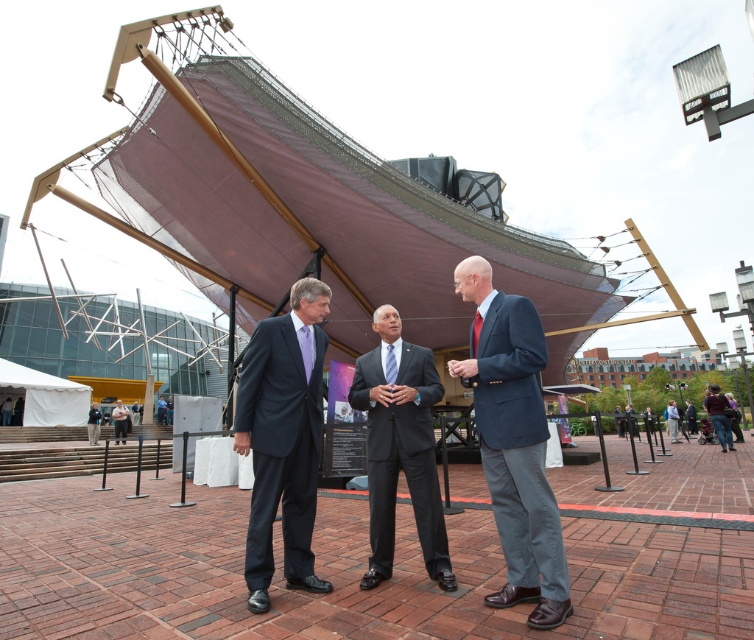
Does matte black suit at center have a lesser height compared to dark blue suit at center?

No.

Which of these two, matte black suit at center or dark blue suit at center, stands taller?

matte black suit at center is taller.

Is point (247, 403) positioned in front of point (400, 330)?

Yes, point (247, 403) is in front of point (400, 330).

You are a GUI agent. You are given a task and a screenshot of the screen. Output one action in this format:
    pyautogui.click(x=<x>, y=<y>)
    Task: Click on the matte black suit at center
    The image size is (754, 640).
    Given the screenshot: What is the action you would take?
    pyautogui.click(x=284, y=438)

Is matte navy blazer at center in front of matte black suit at center?

Yes.

Can you confirm if matte navy blazer at center is positioned above matte black suit at center?

Yes, matte navy blazer at center is above matte black suit at center.

What do you see at coordinates (513, 442) in the screenshot? I see `matte navy blazer at center` at bounding box center [513, 442].

Locate an element on the screen. This screenshot has width=754, height=640. matte navy blazer at center is located at coordinates (513, 442).

Between point (538, 394) and point (431, 566), which one is positioned in front?

Point (538, 394) is in front.

Does point (549, 618) come closer to viewer compared to point (440, 380)?

Yes, point (549, 618) is in front of point (440, 380).

The width and height of the screenshot is (754, 640). Identify the location of matte navy blazer at center. (513, 442).